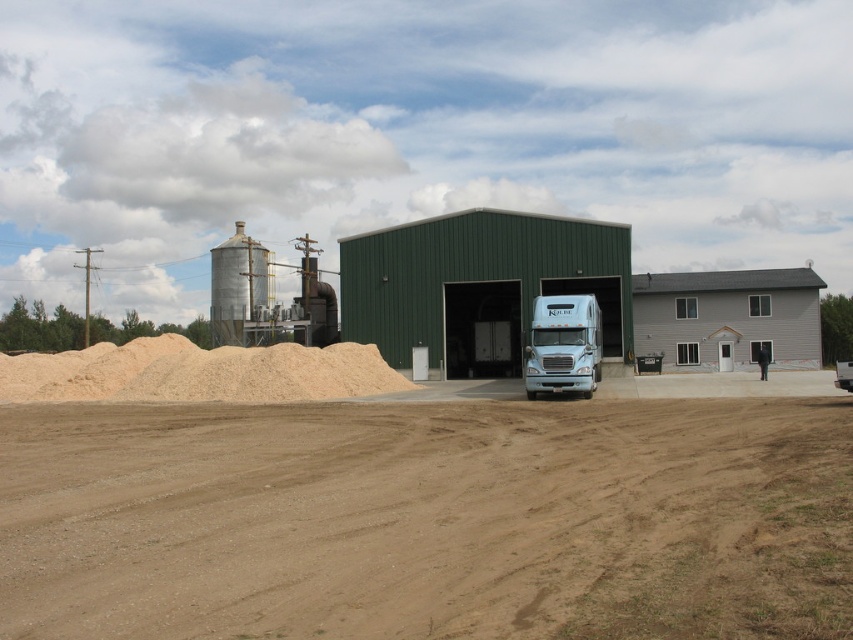
Based on the photo, you are standing in the industrial area looking at the scene. There are two points marked in the image, one at coordinate point (178,534) and the other at point (589,349). Which point is closer to you?

Point (178,534) is closer to the camera than point (589,349), so the point at coordinate point (178,534) is closer to you.